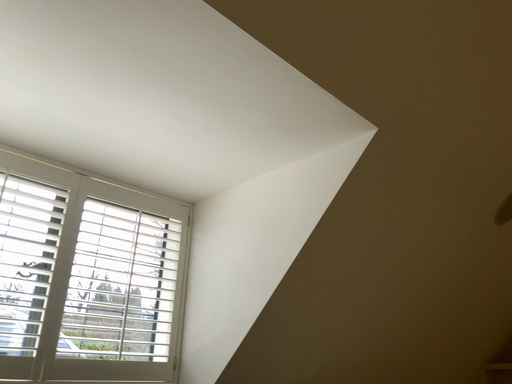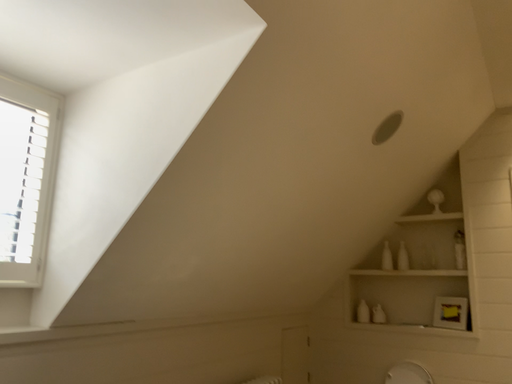
Question: How did the camera likely rotate when shooting the video?

Choices:
 (A) rotated downward
 (B) rotated upward

Answer: (A)